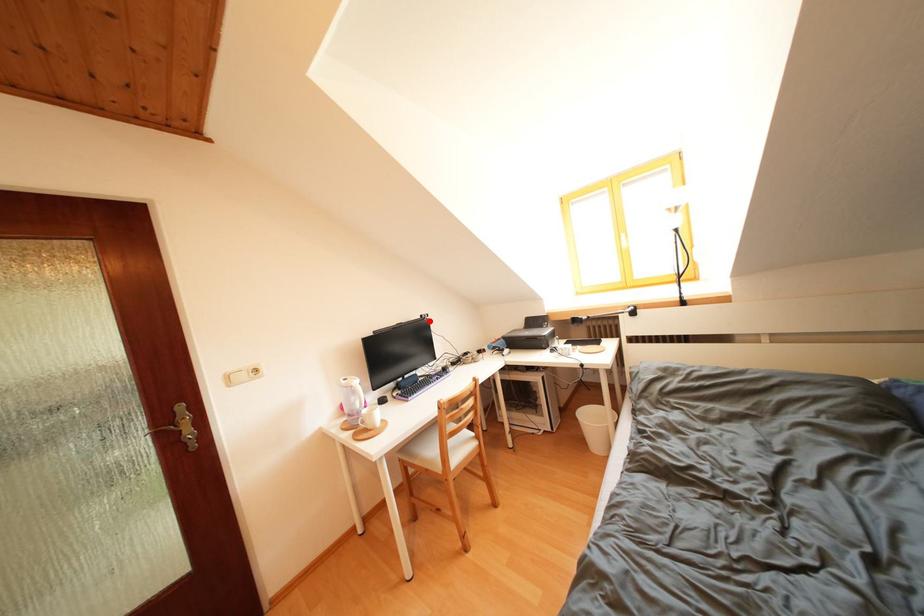
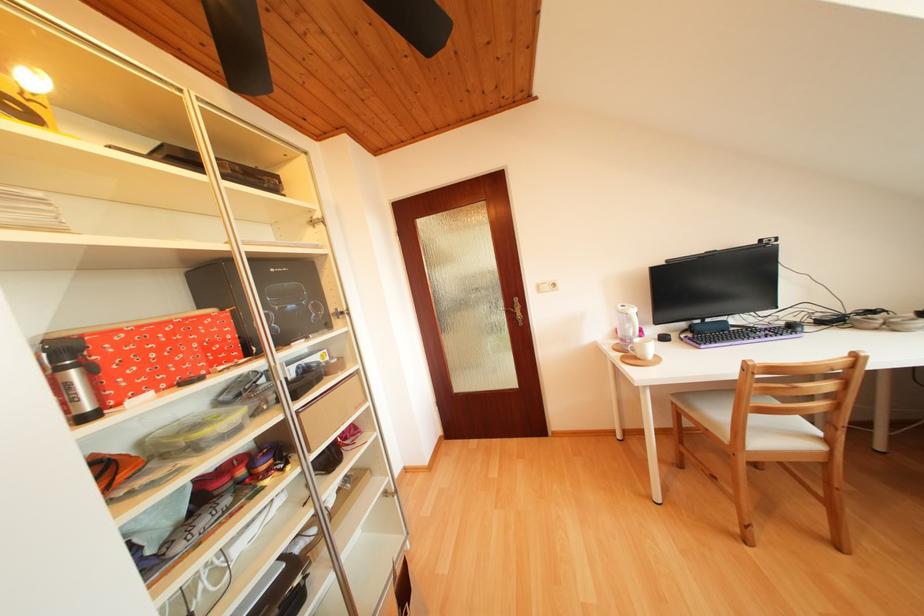
Question: I am providing you with two images of the same scene from different viewpoints. Image1 has a red point marked. In image2, the corresponding 3D location appears at what relative position? Reply with the corresponding letter.

Choices:
 (A) Closer
 (B) Farther

Answer: (B)